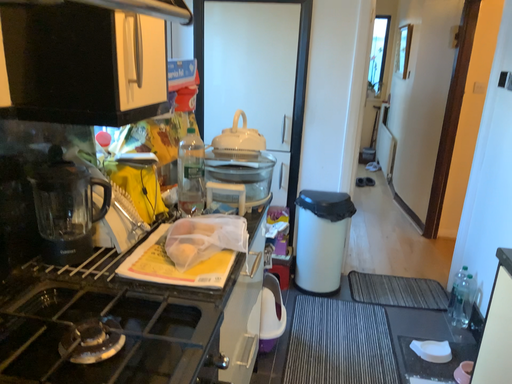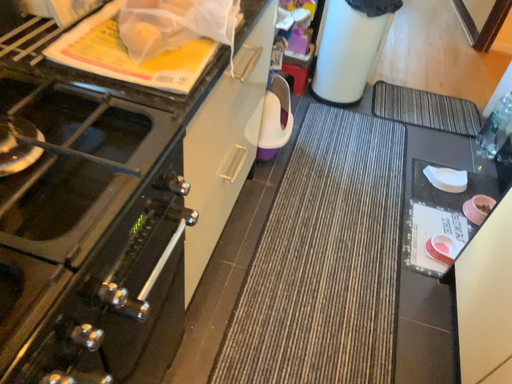
Question: Which way did the camera rotate in the video?

Choices:
 (A) rotated downward
 (B) rotated upward

Answer: (A)